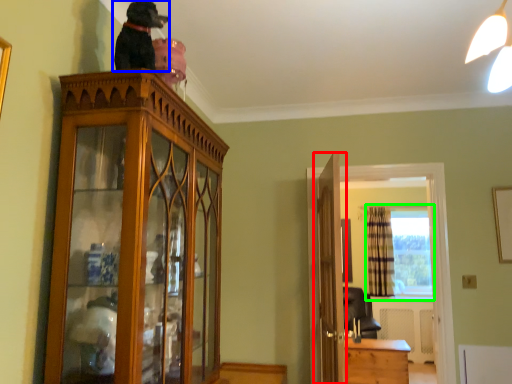
Question: Which object is positioned closest to door (highlighted by a red box)? Select from dog (highlighted by a blue box) and window (highlighted by a green box).

Choices:
 (A) dog
 (B) window

Answer: (A)